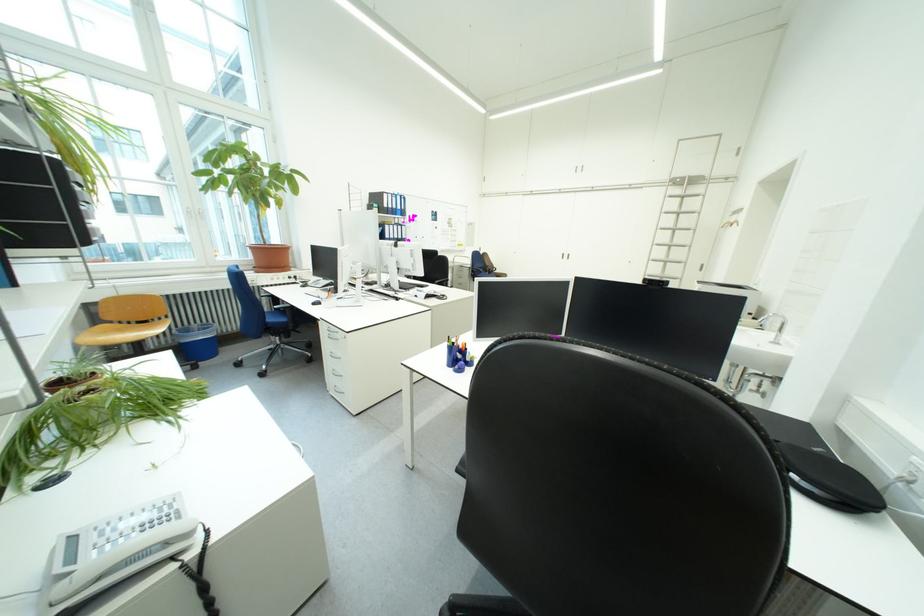
Find where to pull the window handle. Please return your answer as a coordinate pair (x, y).

(196, 215)